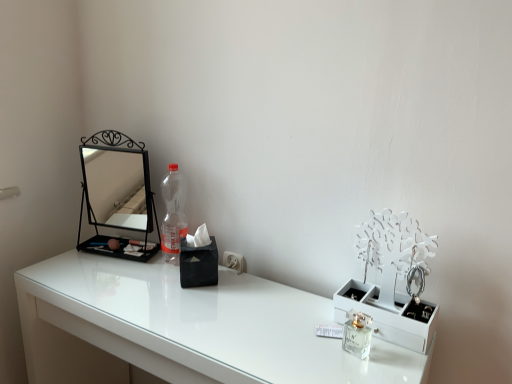
The image size is (512, 384). I want to click on free location above white glossy table at center (from a real-world perspective), so (217, 307).